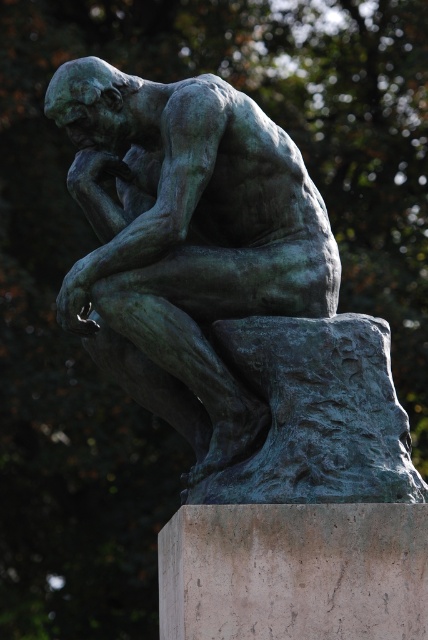
Does green patina bronze statue at center have a lesser width compared to marble pedestal at lower center?

In fact, green patina bronze statue at center might be wider than marble pedestal at lower center.

Is point (249, 397) positioned after point (338, 524)?

Yes, point (249, 397) is behind point (338, 524).

Does point (183, 220) lie in front of point (187, 557)?

No, it is not.

Where is `green patina bronze statue at center`? green patina bronze statue at center is located at coordinates (225, 292).